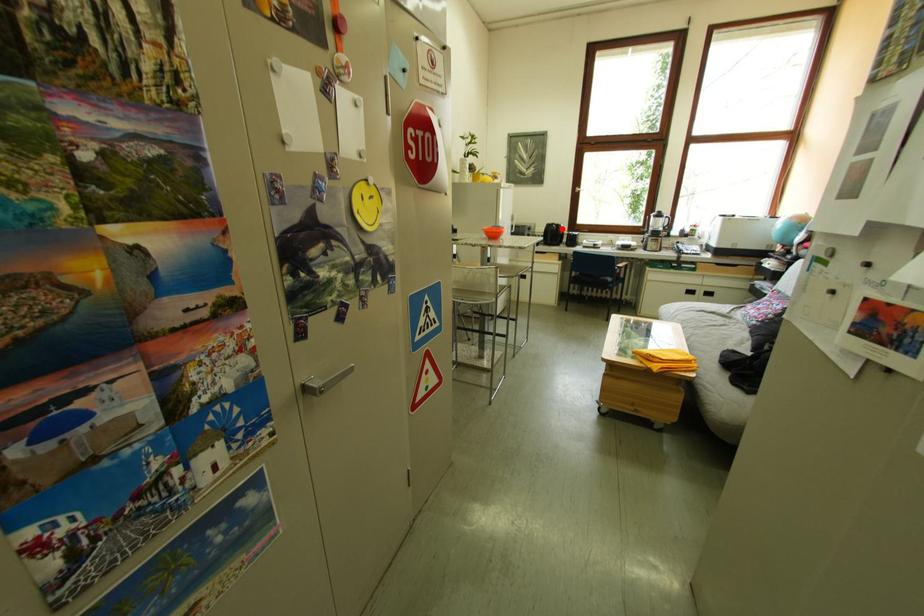
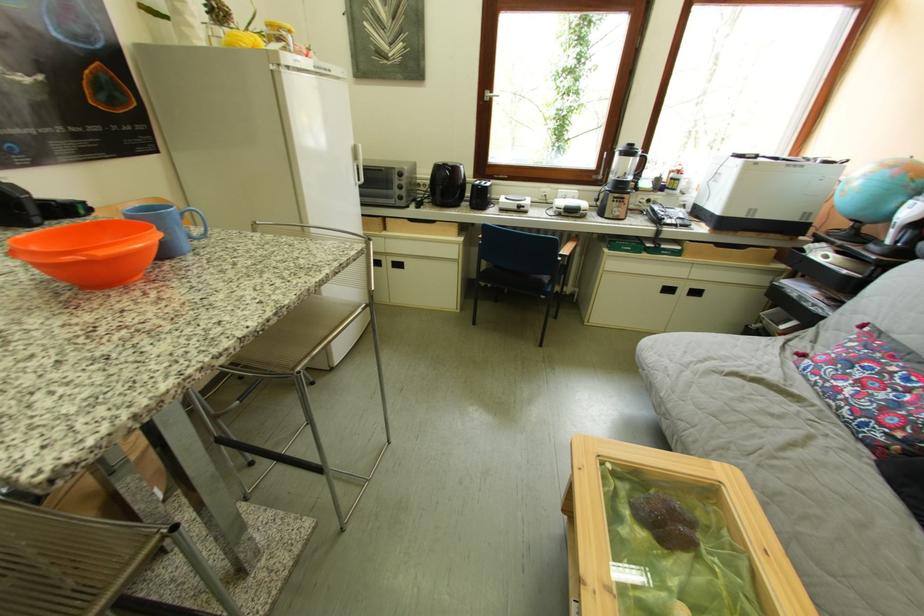
In the second image, find the point that corresponds to the highlighted location in the first image.

(451, 171)